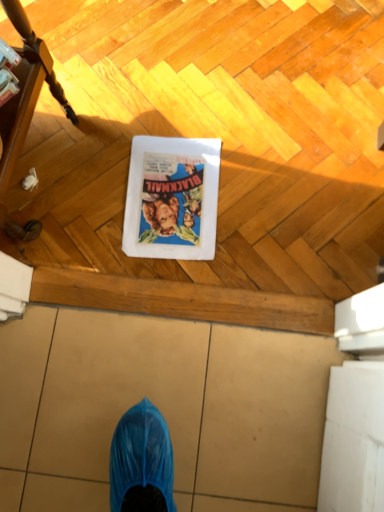
Identify the location of empty space that is ontop of matte paper comic book at center (from a real-world perspective). (167, 192).